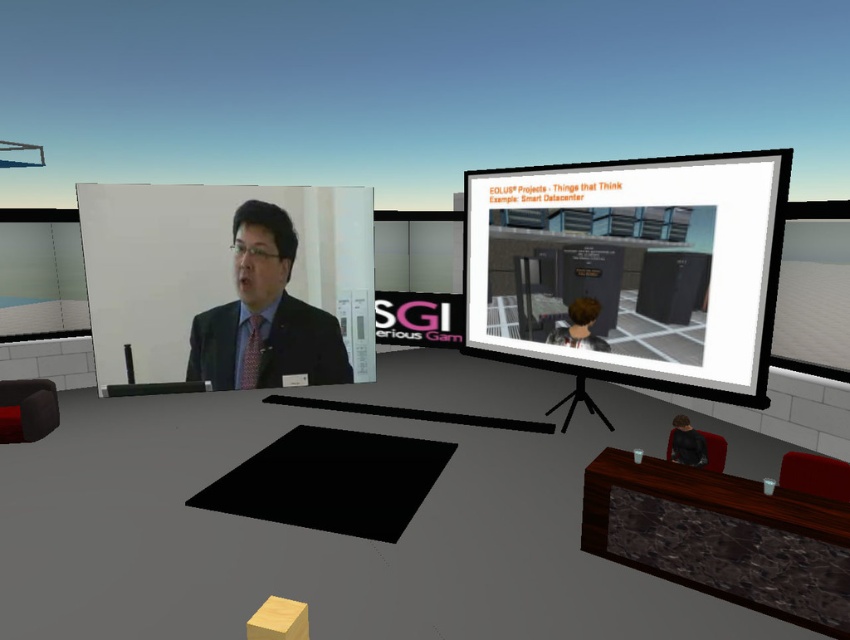
Which is behind, point (598, 340) or point (259, 348)?

Point (598, 340)

This screenshot has height=640, width=850. What do you see at coordinates (579, 326) in the screenshot? I see `light brown hair at upper center` at bounding box center [579, 326].

Locate an element on the screen. The height and width of the screenshot is (640, 850). light brown hair at upper center is located at coordinates (579, 326).

I want to click on matte white monitor at upper right, so click(x=632, y=268).

Can you confirm if matte white monitor at upper right is positioned above matte black suit at center?

Indeed, matte white monitor at upper right is positioned over matte black suit at center.

Measure the distance between point (x=582, y=163) and camera.

A distance of 3.37 meters exists between point (x=582, y=163) and camera.

Image resolution: width=850 pixels, height=640 pixels. What are the coordinates of `matte white monitor at upper right` in the screenshot? It's located at (632, 268).

Find the location of a particular element. matte white monitor at upper right is located at coordinates (632, 268).

Is matte white monitor at upper right to the left of pink satin tie at center from the viewer's perspective?

Incorrect, matte white monitor at upper right is not on the left side of pink satin tie at center.

Describe the element at coordinates (632, 268) in the screenshot. The image size is (850, 640). I see `matte white monitor at upper right` at that location.

Find the location of a particular element. matte white monitor at upper right is located at coordinates (632, 268).